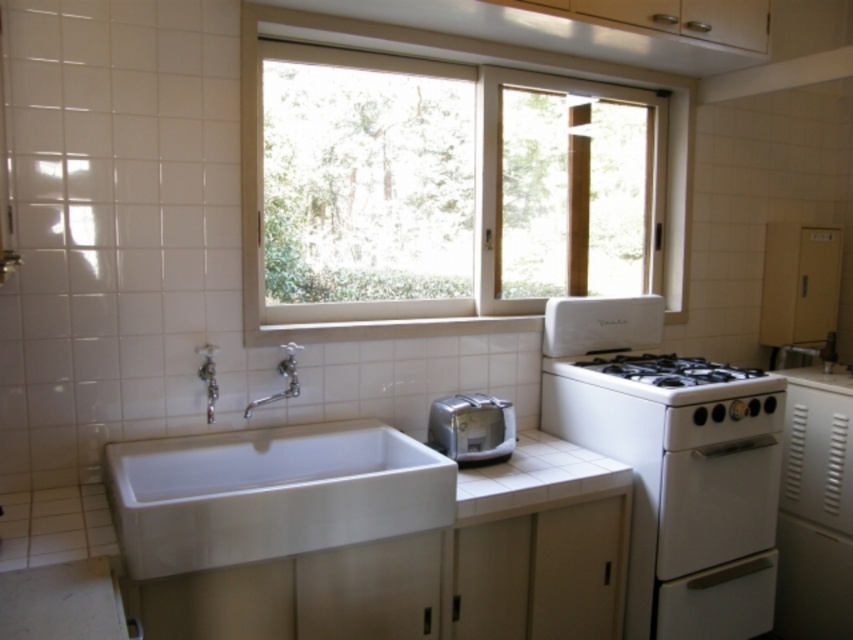
You are standing in the kitchen and want to reach both the white glossy stove at right and the brushed metal faucet at left. Which one is closer to you?

The brushed metal faucet at left is closer to you because the white glossy stove at right is positioned on the right side of it, meaning the faucet is nearer to your current position.

You are organizing a kitchen layout and need to place a new appliance between the satin silver toaster at lower center and the white tile counter top at center. Based on their positions, which side should the appliance be placed on to maintain alignment with the existing items?

The satin silver toaster at lower center is to the left of the white tile counter top at center, so placing the new appliance to the right of the satin silver toaster at lower center and to the left of the white tile counter top at center would maintain alignment with the existing items.

You are standing in the kitchen and want to reach both the satin silver toaster at lower center and the silver metallic faucet at sink left. Which object will you need to step closer to in order to touch it?

The satin silver toaster at lower center is closer to you than the silver metallic faucet at sink left, so you would need to step closer to the silver metallic faucet at sink left to touch it.